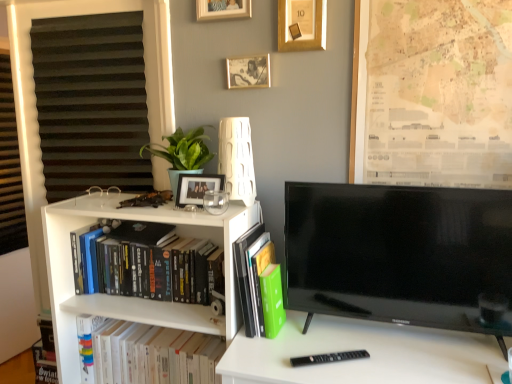
Locate an element on the screen. The height and width of the screenshot is (384, 512). white paper book at lower left, the 3th book in the top-to-bottom sequence is located at coordinates (145, 353).

The image size is (512, 384). What do you see at coordinates (197, 188) in the screenshot? I see `matte black picture frame at upper center, which ranks as the fourth picture frame in top-to-bottom order` at bounding box center [197, 188].

Find the location of `white matte desk at center`. white matte desk at center is located at coordinates tap(364, 359).

Measure the distance between point (187, 293) and camera.

The distance of point (187, 293) from camera is 5.04 feet.

Image resolution: width=512 pixels, height=384 pixels. What do you see at coordinates (146, 263) in the screenshot?
I see `hardcover books at left, which is the third book from bottom to top` at bounding box center [146, 263].

Image resolution: width=512 pixels, height=384 pixels. In order to click on white paper book at lower left, which is the first book in bottom-to-top order in this screenshot , I will do `click(145, 353)`.

Does wooden picture frame at upper center, the first picture frame viewed from the top, have a greater width compared to matte black picture frame at upper center, which ranks as the fourth picture frame in top-to-bottom order?

Incorrect, the width of wooden picture frame at upper center, the first picture frame viewed from the top, does not surpass that of matte black picture frame at upper center, which ranks as the fourth picture frame in top-to-bottom order.

Does point (221, 16) come behind point (204, 187)?

That is True.

How different are the orientations of wooden picture frame at upper center, arranged as the fourth picture frame when ordered from the bottom, and matte black picture frame at upper center, the first picture frame when ordered from bottom to top, in degrees?

6.97 degrees separate the facing orientations of wooden picture frame at upper center, arranged as the fourth picture frame when ordered from the bottom, and matte black picture frame at upper center, the first picture frame when ordered from bottom to top.

Does wooden picture frame at upper center, the first picture frame viewed from the top, appear on the right side of matte black picture frame at upper center, the first picture frame when ordered from bottom to top?

Correct, you'll find wooden picture frame at upper center, the first picture frame viewed from the top, to the right of matte black picture frame at upper center, the first picture frame when ordered from bottom to top.

Does wooden picture frame at upper center, arranged as the fourth picture frame when ordered from the bottom, come in front of hardcover books at left, the first book when ordered from top to bottom?

No, it is not.

From a real-world perspective, between wooden picture frame at upper center, the first picture frame viewed from the top, and hardcover books at left, the first book when ordered from top to bottom, who is vertically lower?

In real-world perspective, hardcover books at left, the first book when ordered from top to bottom, is lower.

From the image's perspective, is wooden picture frame at upper center, arranged as the fourth picture frame when ordered from the bottom, located above or below hardcover books at left, which is the third book from bottom to top?

wooden picture frame at upper center, arranged as the fourth picture frame when ordered from the bottom, is situated higher than hardcover books at left, which is the third book from bottom to top, in the image.

Is wooden picture frame at upper center, the first picture frame viewed from the top, oriented towards hardcover books at left, the first book when ordered from top to bottom?

No, wooden picture frame at upper center, the first picture frame viewed from the top, is not aimed at hardcover books at left, the first book when ordered from top to bottom.

Is wooden picture frame at upper center, arranged as the fourth picture frame when ordered from the bottom, turned away from wooden photo frame at upper center, which appears as the 2th picture frame when ordered from the bottom?

No.

Is point (234, 10) more distant than point (228, 61)?

No, it is in front of (228, 61).

Which of these two, wooden picture frame at upper center, arranged as the fourth picture frame when ordered from the bottom, or wooden photo frame at upper center, placed as the third picture frame when sorted from top to bottom, is bigger?

With larger size is wooden picture frame at upper center, arranged as the fourth picture frame when ordered from the bottom.

Considering the sizes of wooden picture frame at upper center, arranged as the fourth picture frame when ordered from the bottom, and wooden photo frame at upper center, which appears as the 2th picture frame when ordered from the bottom, in the image, is wooden picture frame at upper center, arranged as the fourth picture frame when ordered from the bottom, taller or shorter than wooden photo frame at upper center, which appears as the 2th picture frame when ordered from the bottom,?

In the image, wooden picture frame at upper center, arranged as the fourth picture frame when ordered from the bottom, appears to be taller than wooden photo frame at upper center, which appears as the 2th picture frame when ordered from the bottom.

Is the depth of beige paper map at upper right less than that of hardcover books at left, the first book when ordered from top to bottom?

Yes, beige paper map at upper right is in front of hardcover books at left, the first book when ordered from top to bottom.

From the image's perspective, is beige paper map at upper right positioned above or below hardcover books at left, which is the third book from bottom to top?

beige paper map at upper right is above hardcover books at left, which is the third book from bottom to top.

Image resolution: width=512 pixels, height=384 pixels. I want to click on the 1st book behind the beige paper map at upper right, so click(x=146, y=263).

Is beige paper map at upper right not near hardcover books at left, which is the third book from bottom to top?

Answer: They are positioned close to each other.

Which is in front, green matte plant at upper left or white matte lamp at upper center?

Positioned in front is green matte plant at upper left.

Based on the photo, from the image's perspective, between green matte plant at upper left and white matte lamp at upper center, which one is located above?

From the image's view, white matte lamp at upper center is above.

From a real-world perspective, which is physically above, green matte plant at upper left or white matte lamp at upper center?

white matte lamp at upper center is physically above.

Could you tell me if green matte plant at upper left is turned towards white matte lamp at upper center?

No, green matte plant at upper left is not turned towards white matte lamp at upper center.

How different are the orientations of matte black picture frame at upper center, the first picture frame when ordered from bottom to top, and green matte plant at upper left in degrees?

6.12 degrees.

Is matte black picture frame at upper center, the first picture frame when ordered from bottom to top, inside the boundaries of green matte plant at upper left, or outside?

matte black picture frame at upper center, the first picture frame when ordered from bottom to top, lies within the bounds of green matte plant at upper left.

Is matte black picture frame at upper center, which ranks as the fourth picture frame in top-to-bottom order, far from green matte plant at upper left?

No, there isn't a large distance between matte black picture frame at upper center, which ranks as the fourth picture frame in top-to-bottom order, and green matte plant at upper left.

From a real-world perspective, does matte black picture frame at upper center, the first picture frame when ordered from bottom to top, stand above green matte plant at upper left?

Actually, matte black picture frame at upper center, the first picture frame when ordered from bottom to top, is physically below green matte plant at upper left in the real world.

How many degrees apart are the facing directions of white matte lamp at upper center and gold metallic picture frame at upper center, which is the second picture frame from top to bottom?

The facing directions of white matte lamp at upper center and gold metallic picture frame at upper center, which is the second picture frame from top to bottom, are 6.97 degrees apart.

Which object is positioned more to the left, white matte lamp at upper center or gold metallic picture frame at upper center, placed as the third picture frame when sorted from bottom to top?

white matte lamp at upper center is more to the left.

From the image's perspective, who appears lower, white matte lamp at upper center or gold metallic picture frame at upper center, placed as the third picture frame when sorted from bottom to top?

white matte lamp at upper center.

From a real-world perspective, which picture frame is the 3rd one underneath the wooden picture frame at upper center, arranged as the fourth picture frame when ordered from the bottom? Please provide its 2D coordinates.

[(197, 188)]

At what (x,y) coordinates should I click in order to perform the action: click on picture frame that is the 1st object located behind the hardcover books at left, the first book when ordered from top to bottom. Please return your answer as a coordinate pair (x, y). Image resolution: width=512 pixels, height=384 pixels. Looking at the image, I should click on (223, 9).

Considering their positions, is hardcover books at left, the first book when ordered from top to bottom, positioned further to black glossy tv at right than beige paper map at upper right?

hardcover books at left, the first book when ordered from top to bottom, is further to black glossy tv at right.

Looking at the image, which one is located further to wooden picture frame at upper center, arranged as the fourth picture frame when ordered from the bottom, matte black picture frame at upper center, the first picture frame when ordered from bottom to top, or green matte plant at upper left?

Among the two, matte black picture frame at upper center, the first picture frame when ordered from bottom to top, is located further to wooden picture frame at upper center, arranged as the fourth picture frame when ordered from the bottom.

Estimate the real-world distances between objects in this image. Which object is further from black glossy tv at right, beige paper map at upper right or white matte lamp at upper center?

white matte lamp at upper center is positioned further to the anchor black glossy tv at right.

When comparing their distances from white matte desk at center, does green matte plant at upper left or green matte book at center, the 2th book positioned from the bottom, seem further?

Based on the image, green matte plant at upper left appears to be further to white matte desk at center.

Considering their positions, is wooden photo frame at upper center, placed as the third picture frame when sorted from top to bottom, positioned further to green matte plant at upper left than white matte desk at center?

white matte desk at center is further to green matte plant at upper left.

Looking at the image, which one is located closer to white matte lamp at upper center, green matte book at center, the 2th book positioned from the bottom, or white matte desk at center?

green matte book at center, the 2th book positioned from the bottom.

Which object lies nearer to the anchor point wooden picture frame at upper center, arranged as the fourth picture frame when ordered from the bottom, white matte desk at center or beige paper map at upper right?

beige paper map at upper right.

When comparing their distances from wooden photo frame at upper center, which appears as the 2th picture frame when ordered from the bottom, does beige paper map at upper right or hardcover books at left, the first book when ordered from top to bottom, seem closer?

beige paper map at upper right lies closer to wooden photo frame at upper center, which appears as the 2th picture frame when ordered from the bottom, than the other object.

The height and width of the screenshot is (384, 512). What are the coordinates of `picture frame that lies between wooden photo frame at upper center, placed as the third picture frame when sorted from top to bottom, and hardcover books at left, which is the third book from bottom to top, from top to bottom` in the screenshot? It's located at (197, 188).

Identify the location of television between gold metallic picture frame at upper center, which is the second picture frame from top to bottom, and hardcover books at left, the first book when ordered from top to bottom, from top to bottom. The width and height of the screenshot is (512, 384). (399, 254).

Identify the location of television between gold metallic picture frame at upper center, which is the second picture frame from top to bottom, and green matte book at center, the second book from the top, vertically. This screenshot has width=512, height=384. (399, 254).

This screenshot has width=512, height=384. What are the coordinates of `picture frame situated between wooden picture frame at upper center, arranged as the fourth picture frame when ordered from the bottom, and gold metallic picture frame at upper center, which is the second picture frame from top to bottom, from left to right` in the screenshot? It's located at (248, 72).